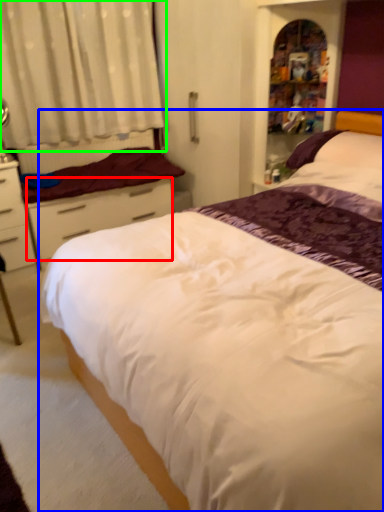
Question: Which object is positioned closest to drawer (highlighted by a red box)? Select from bed (highlighted by a blue box) and curtain (highlighted by a green box).

Choices:
 (A) bed
 (B) curtain

Answer: (B)